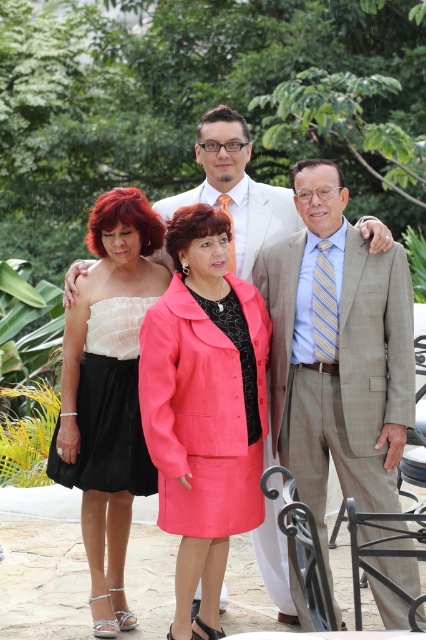
You are a photographer trying to capture the group photo. You notice the matte white strapless top at left and the black satin skirt at lower left. Which of these two items is positioned higher in the image?

The matte white strapless top at left is taller than the black satin skirt at lower left, so it is positioned higher in the image.

You are standing in the garden and want to reach the point marked at coordinates (377,372). If your walking speed is 3 feet per second, how many seconds will it take you to reach that point?

The point at coordinates (377,372) is 18.87 feet away from the viewer. At a walking speed of 3 feet per second, it would take approximately 6.3 seconds to reach that point.

You are standing at the point labeled point (353, 477) and want to walk to the point labeled point (112, 417). Which direction should you move in relation to the scene?

You should move backward because point (353, 477) is in front of point (112, 417).